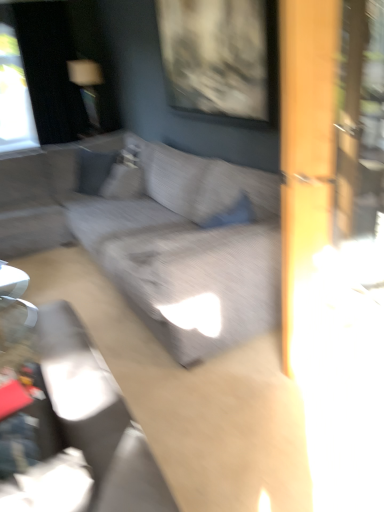
Question: From a real-world perspective, is textured gray couch at center positioned over matte gray swivel chair at center based on gravity?

Choices:
 (A) no
 (B) yes

Answer: (B)

Question: Is textured gray couch at center positioned behind matte gray swivel chair at center?

Choices:
 (A) yes
 (B) no

Answer: (A)

Question: Is textured gray couch at center turned away from matte gray swivel chair at center?

Choices:
 (A) no
 (B) yes

Answer: (A)

Question: Does textured gray couch at center have a larger size compared to matte gray swivel chair at center?

Choices:
 (A) yes
 (B) no

Answer: (A)

Question: From the image's perspective, would you say textured gray couch at center is positioned over matte gray swivel chair at center?

Choices:
 (A) yes
 (B) no

Answer: (A)

Question: Is textured gray couch at center shorter than matte gray swivel chair at center?

Choices:
 (A) yes
 (B) no

Answer: (A)

Question: Is matte gray swivel chair at center next to suede-like gray pillow at upper left and touching it?

Choices:
 (A) no
 (B) yes

Answer: (A)

Question: Is matte gray swivel chair at center to the right of suede-like gray pillow at upper left from the viewer's perspective?

Choices:
 (A) no
 (B) yes

Answer: (B)

Question: Is matte gray swivel chair at center surrounding suede-like gray pillow at upper left?

Choices:
 (A) no
 (B) yes

Answer: (A)

Question: Can you confirm if matte gray swivel chair at center is thinner than suede-like gray pillow at upper left?

Choices:
 (A) no
 (B) yes

Answer: (A)

Question: From the image's perspective, would you say matte gray swivel chair at center is shown under suede-like gray pillow at upper left?

Choices:
 (A) yes
 (B) no

Answer: (A)

Question: From a real-world perspective, does matte gray swivel chair at center stand above suede-like gray pillow at upper left?

Choices:
 (A) no
 (B) yes

Answer: (A)

Question: Can you confirm if suede-like gray pillow at upper left is shorter than textured gray couch at center?

Choices:
 (A) no
 (B) yes

Answer: (B)